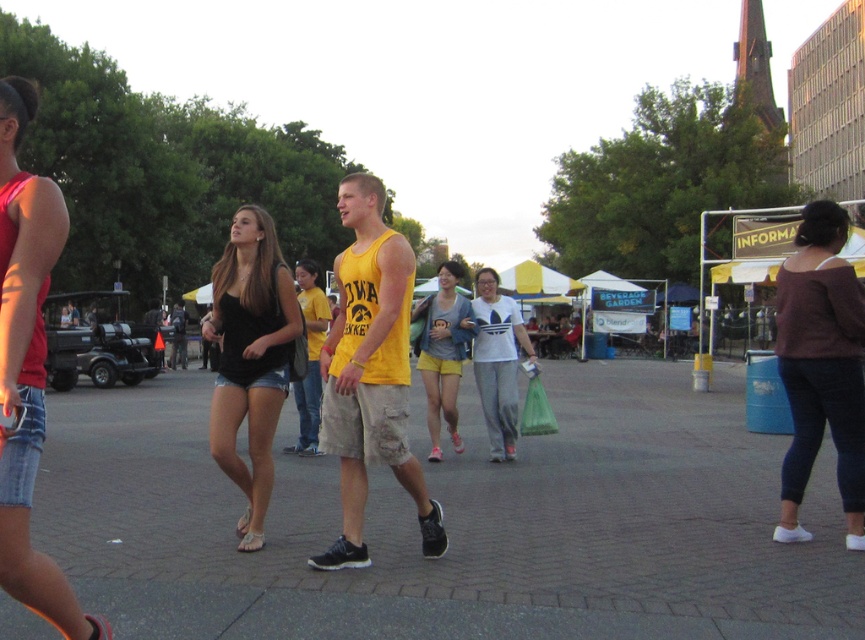
You are a photographer trying to capture a clear shot of the yellow cotton tank top at center without the gray concrete pavement at center blocking the view. Is it possible to do so given their positions?

The gray concrete pavement at center is in front of the yellow cotton tank top at center, so it would block the view. You cannot capture a clear shot of the yellow cotton tank top at center without the gray concrete pavement at center in the way.

You are organizing a photo shoot and need to ensure that the dark purple sweater at right and the denim shorts at center are visible in the frame. Based on their positions, which object is closer to the right edge of the image?

The dark purple sweater at right is positioned on the right side of the denim shorts at center, so it is closer to the right edge of the image.